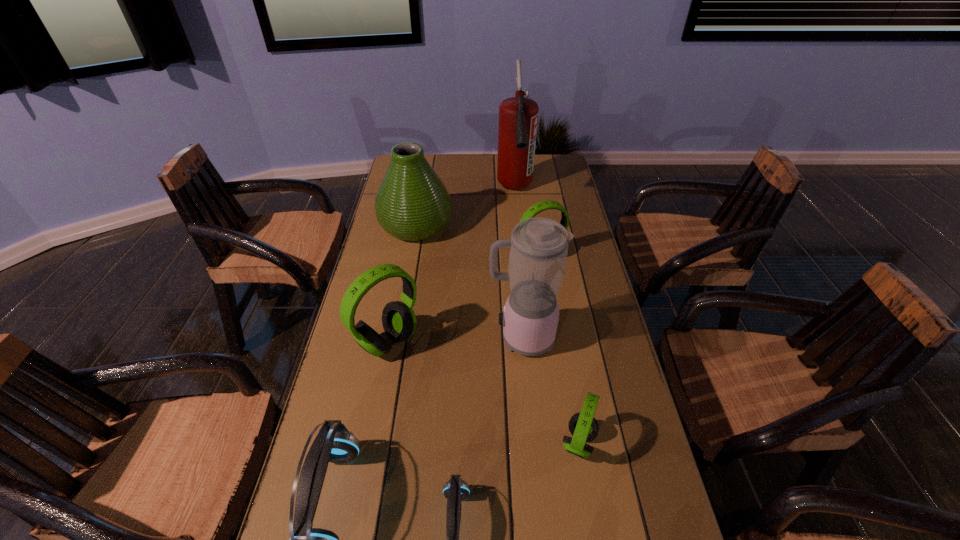
This screenshot has height=540, width=960. What are the coordinates of `vacant space situated at the nozzle of the tallest object` in the screenshot? It's located at (518, 226).

Locate an element on the screen. This screenshot has width=960, height=540. free space located 0.350m on the base of the food processor near the control knob is located at coordinates (361, 338).

Find the location of a particular element. The width and height of the screenshot is (960, 540). blank space located on the base of the food processor near the control knob is located at coordinates (420, 338).

You are a GUI agent. You are given a task and a screenshot of the screen. Output one action in this format:
    pyautogui.click(x=<x>, y=<y>)
    Task: Click on the free region located on the base of the food processor near the control knob
    This screenshot has width=960, height=540.
    Given the screenshot: What is the action you would take?
    pyautogui.click(x=383, y=338)

Image resolution: width=960 pixels, height=540 pixels. I want to click on vacant space positioned 0.230m on the right of the vase, so click(516, 226).

The width and height of the screenshot is (960, 540). What are the coordinates of `vacant position located on the right of the tallest headset` in the screenshot? It's located at (471, 342).

Where is `vacant position located 0.210m on the back of the farthest headset`? This screenshot has height=540, width=960. vacant position located 0.210m on the back of the farthest headset is located at coordinates (534, 210).

The image size is (960, 540). In order to click on vacant space located 0.050m on the back of the smallest green headset in this screenshot , I will do `click(571, 400)`.

I want to click on object present at the far edge, so click(518, 116).

Locate an element on the screen. vase at the left edge is located at coordinates (412, 204).